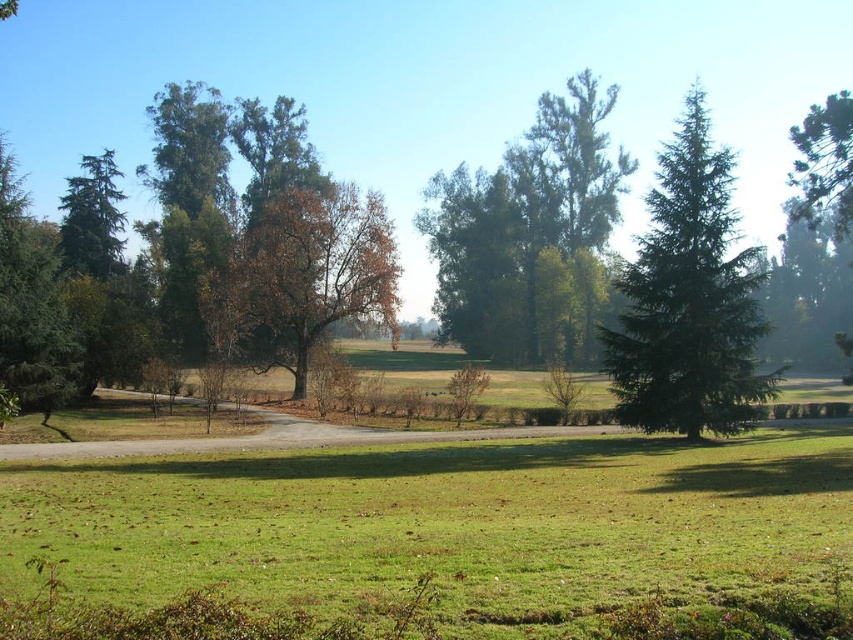
You are standing at point (334, 252) and want to walk to point (732, 385). Given the park layout described, will you have to walk towards the foreground or background to reach your destination?

Since point (732, 385) is in front of point (334, 252), you will need to walk towards the foreground to reach your destination.

You are standing at point A and want to walk to point B. You see two points marked as point A at point (x=637, y=250) and point B at point (x=28, y=314). Which point is closer to your current location if you are at point A?

Point A at point (x=637, y=250) is your current location, so it is the closest to you. Point B at point (x=28, y=314) is further away.